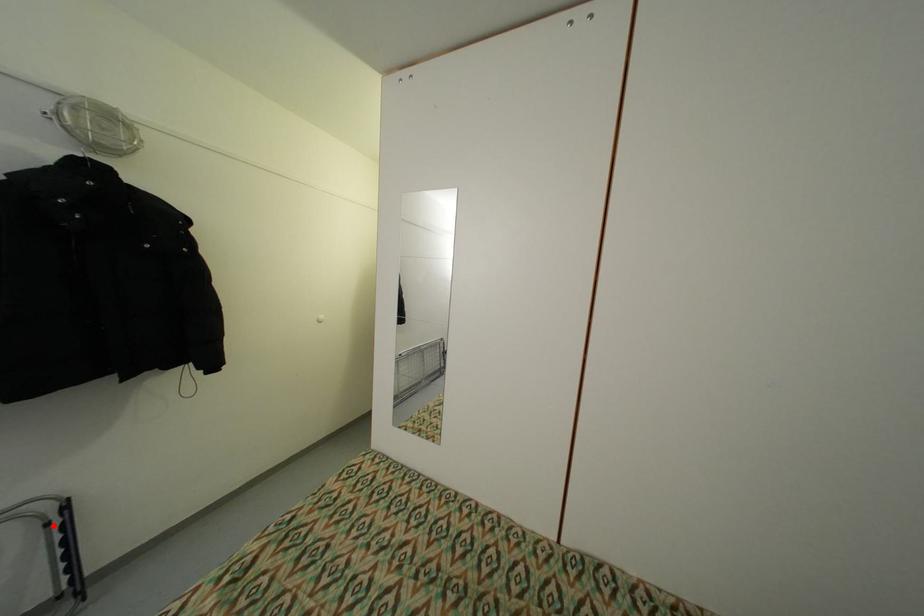
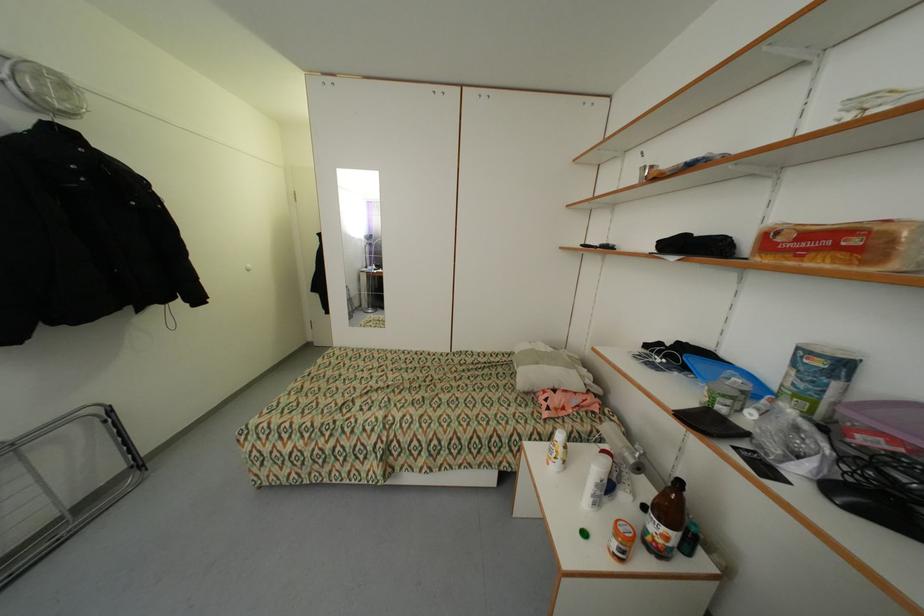
Question: A red point is marked in image1. In image2, is the corresponding 3D point closer to the camera or farther? Reply with the corresponding letter.

Choices:
 (A) The corresponding 3D point is closer.
 (B) The corresponding 3D point is farther.

Answer: (B)